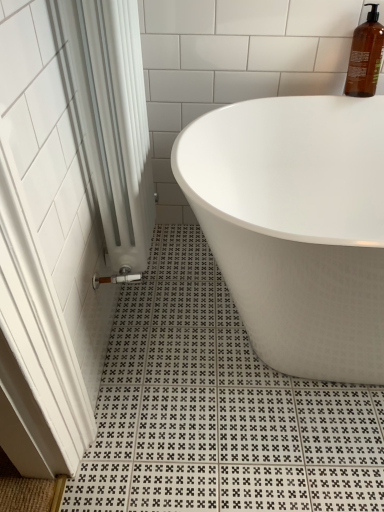
Question: From a real-world perspective, is translucent amber bottle at upper right positioned over white fabric shower curtain at left based on gravity?

Choices:
 (A) no
 (B) yes

Answer: (B)

Question: Is translucent amber bottle at upper right positioned behind white fabric shower curtain at left?

Choices:
 (A) yes
 (B) no

Answer: (A)

Question: Is translucent amber bottle at upper right beside white fabric shower curtain at left?

Choices:
 (A) no
 (B) yes

Answer: (A)

Question: Does translucent amber bottle at upper right appear on the right side of white fabric shower curtain at left?

Choices:
 (A) no
 (B) yes

Answer: (B)

Question: Can you confirm if translucent amber bottle at upper right is smaller than white fabric shower curtain at left?

Choices:
 (A) no
 (B) yes

Answer: (B)

Question: From the image's perspective, is translucent amber bottle at upper right located above white fabric shower curtain at left?

Choices:
 (A) no
 (B) yes

Answer: (B)

Question: Is translucent amber bottle at upper right closer to the viewer compared to white glossy bathtub at center?

Choices:
 (A) yes
 (B) no

Answer: (B)

Question: Considering the relative sizes of translucent amber bottle at upper right and white glossy bathtub at center in the image provided, is translucent amber bottle at upper right bigger than white glossy bathtub at center?

Choices:
 (A) no
 (B) yes

Answer: (A)

Question: Can you confirm if translucent amber bottle at upper right is shorter than white glossy bathtub at center?

Choices:
 (A) yes
 (B) no

Answer: (A)

Question: Is translucent amber bottle at upper right at the right side of white glossy bathtub at center?

Choices:
 (A) no
 (B) yes

Answer: (B)

Question: From the image's perspective, is translucent amber bottle at upper right under white glossy bathtub at center?

Choices:
 (A) no
 (B) yes

Answer: (A)

Question: Is translucent amber bottle at upper right aimed at white glossy bathtub at center?

Choices:
 (A) yes
 (B) no

Answer: (B)

Question: Is white glossy bathtub at center with white fabric shower curtain at left?

Choices:
 (A) yes
 (B) no

Answer: (B)